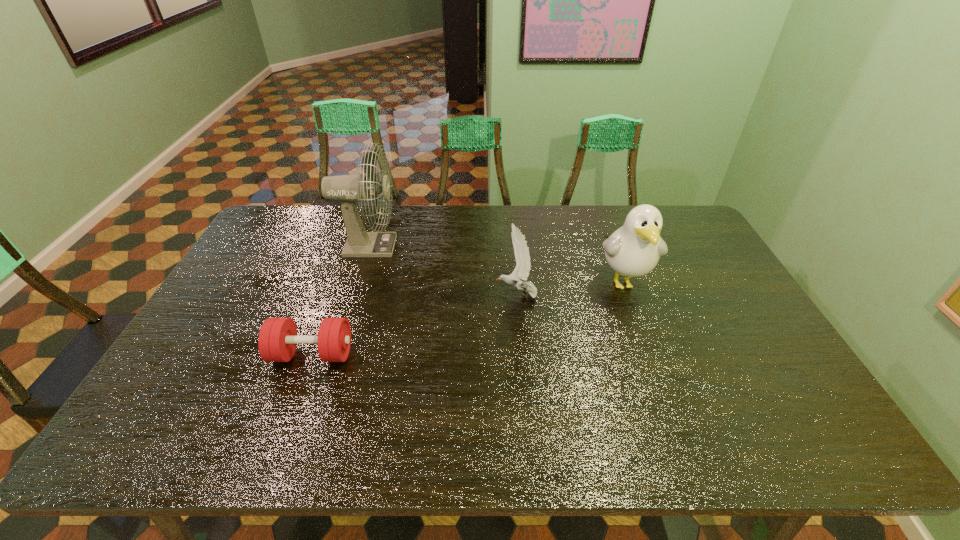
The height and width of the screenshot is (540, 960). I want to click on fan, so pyautogui.click(x=349, y=189).

Locate an element on the screen. the rightmost object is located at coordinates (633, 250).

I want to click on the taller gull, so click(633, 250).

Locate an element on the screen. The height and width of the screenshot is (540, 960). the left gull is located at coordinates (522, 255).

Identify the location of the shorter gull. (522, 255).

In order to click on the shortest object in this screenshot , I will do `click(277, 341)`.

Locate an element on the screen. The image size is (960, 540). the nearest object is located at coordinates (277, 341).

In order to click on free space located on the air flow direction of the tallest object in this screenshot , I will do `click(487, 246)`.

Image resolution: width=960 pixels, height=540 pixels. In order to click on free point located 0.090m on the beak of the right gull in this screenshot , I will do `click(641, 331)`.

At what (x,y) coordinates should I click in order to perform the action: click on vacant position located 0.160m at the tip of the beak of the shorter gull. Please return your answer as a coordinate pair (x, y). The width and height of the screenshot is (960, 540). Looking at the image, I should click on (443, 295).